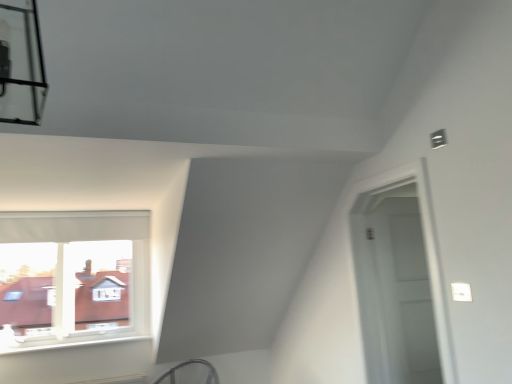
Describe the element at coordinates (399, 284) in the screenshot. I see `transparent glass door at right` at that location.

Measure the distance between transparent glass door at right and camera.

They are 2.15 meters apart.

Identify the location of transparent glass door at right. The width and height of the screenshot is (512, 384). (399, 284).

Where is `transparent glass door at right`? transparent glass door at right is located at coordinates (399, 284).